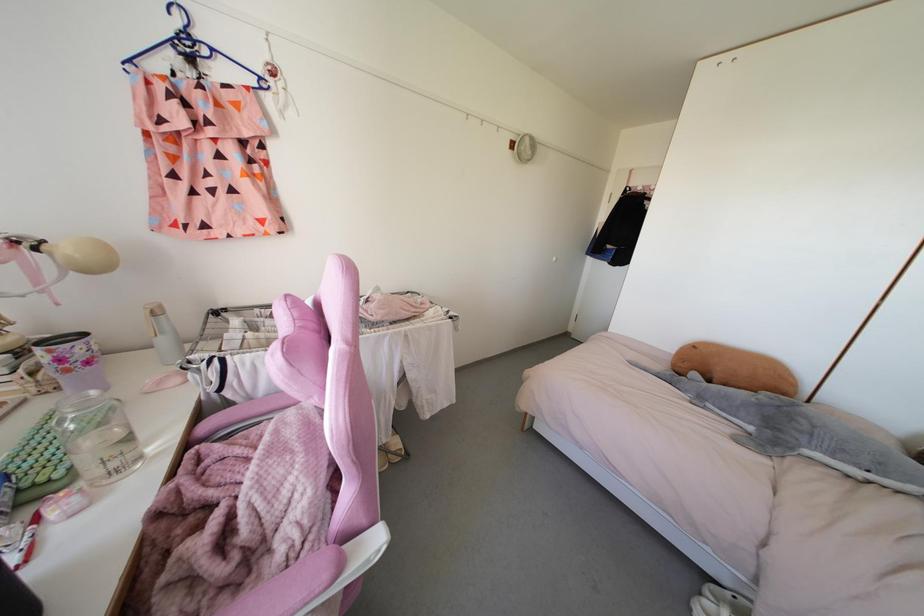
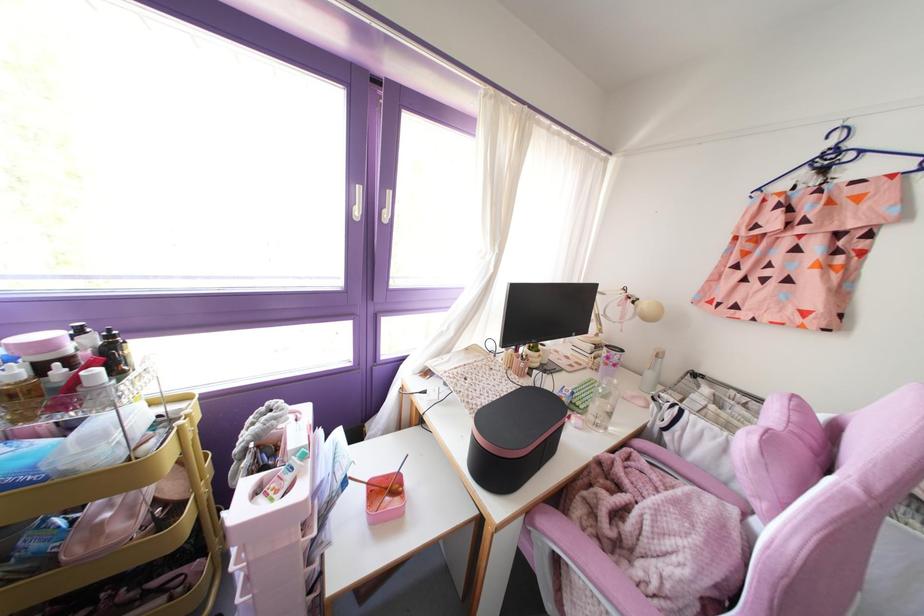
Find the pixel in the second image that matches point (163, 341) in the first image.

(649, 374)